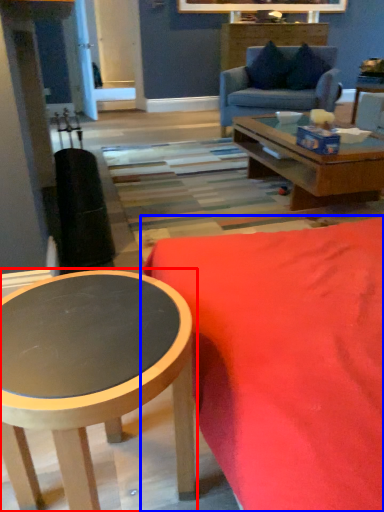
Question: Which object appears farthest to the camera in this image, coffee table (highlighted by a red box) or studio couch (highlighted by a blue box)?

Choices:
 (A) coffee table
 (B) studio couch

Answer: (A)